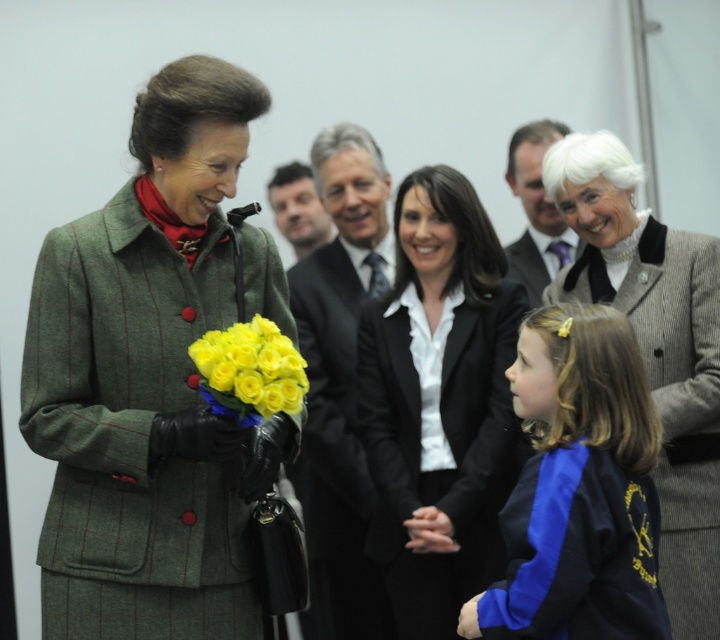
You are a photographer standing in the conference room. You want to take a photo of the gray woolen blazer at upper right and the yellow matte roses at center. If your camera can focus on objects within a 1 meter range, will both items be in focus?

The gray woolen blazer at upper right is 1.09 meters from the yellow matte roses at center. Since the distance between them is slightly over 1 meter, the camera might not be able to keep both in focus simultaneously.

You are standing in the conference room and want to walk towards the two points marked in the scene. Which point, point [540,371] or point [271,198], will you reach first?

You will reach point [540,371] first because it is closer to you than point [271,198].

You are a photographer at a formal event. You need to capture a photo of the gray woolen blazer at upper right and the yellow matte roses at center. Which object should you focus on first if you want to include both in the frame without moving the camera?

The gray woolen blazer at upper right is taller than the yellow matte roses at center, so you should focus on the gray woolen blazer at upper right first to ensure it fits within the frame.